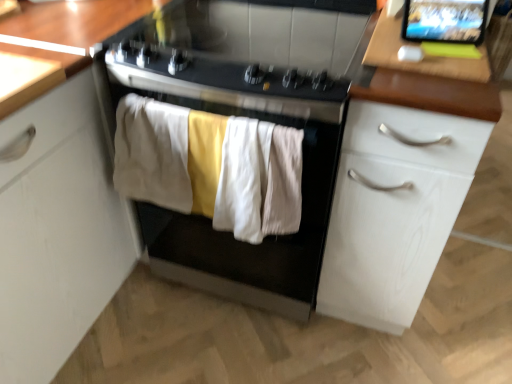
Question: Considering the relative sizes of soft cotton towels at center, which is the second clothing in right-to-left order, and white wood cabinet at right in the image provided, is soft cotton towels at center, which is the second clothing in right-to-left order, wider than white wood cabinet at right?

Choices:
 (A) yes
 (B) no

Answer: (B)

Question: Is soft cotton towels at center, the 2th clothing from the left, completely or partially outside of white wood cabinet at right?

Choices:
 (A) yes
 (B) no

Answer: (A)

Question: Is the position of soft cotton towels at center, the 2th clothing from the left, more distant than that of white wood cabinet at right?

Choices:
 (A) no
 (B) yes

Answer: (B)

Question: Is soft cotton towels at center, which is the second clothing in right-to-left order, aimed at white wood cabinet at right?

Choices:
 (A) yes
 (B) no

Answer: (B)

Question: Can you confirm if soft cotton towels at center, which is the second clothing in right-to-left order, is shorter than white wood cabinet at right?

Choices:
 (A) yes
 (B) no

Answer: (A)

Question: Can you confirm if soft cotton towels at center, the 2th clothing from the left, is thinner than white wood cabinet at right?

Choices:
 (A) no
 (B) yes

Answer: (B)

Question: From the image's perspective, is beige cotton towel at center, the first clothing in the left-to-right sequence, located above black glass gas stove at center?

Choices:
 (A) no
 (B) yes

Answer: (A)

Question: Is beige cotton towel at center, the third clothing viewed from the right, located outside black glass gas stove at center?

Choices:
 (A) yes
 (B) no

Answer: (A)

Question: Is black glass gas stove at center surrounded by beige cotton towel at center, the first clothing in the left-to-right sequence?

Choices:
 (A) yes
 (B) no

Answer: (B)

Question: Can you confirm if beige cotton towel at center, the first clothing in the left-to-right sequence, is smaller than black glass gas stove at center?

Choices:
 (A) no
 (B) yes

Answer: (B)

Question: From a real-world perspective, is beige cotton towel at center, the first clothing in the left-to-right sequence, on top of black glass gas stove at center?

Choices:
 (A) no
 (B) yes

Answer: (A)

Question: Can you confirm if beige cotton towel at center, the first clothing in the left-to-right sequence, is thinner than black glass gas stove at center?

Choices:
 (A) no
 (B) yes

Answer: (B)

Question: Is black glass gas stove at center at the back of matte black tablet at upper right?

Choices:
 (A) yes
 (B) no

Answer: (B)